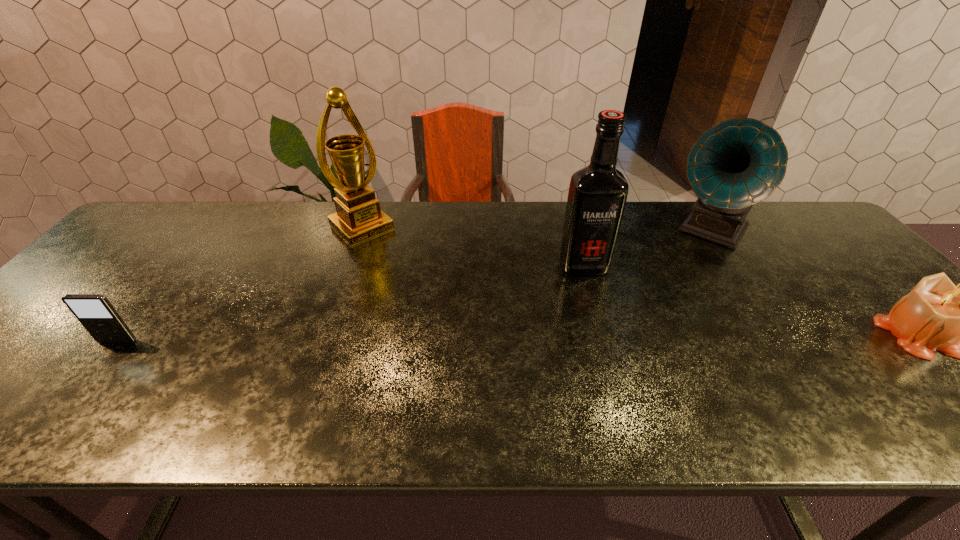
Where is `free space on the desktop that is between the leftmost object and the candle and is positioned from the horn of the phonograph_record`? Image resolution: width=960 pixels, height=540 pixels. free space on the desktop that is between the leftmost object and the candle and is positioned from the horn of the phonograph_record is located at coordinates (639, 338).

Locate an element on the screen. This screenshot has height=540, width=960. free space on the desktop that is between the iPod and the rightmost object and is positioned on the front-facing side of the second object from left to right is located at coordinates (483, 339).

Where is `vacant spot on the desktop that is between the shortest object and the rightmost object and is positioned on the front-facing side of the liquor`? This screenshot has width=960, height=540. vacant spot on the desktop that is between the shortest object and the rightmost object and is positioned on the front-facing side of the liquor is located at coordinates (611, 338).